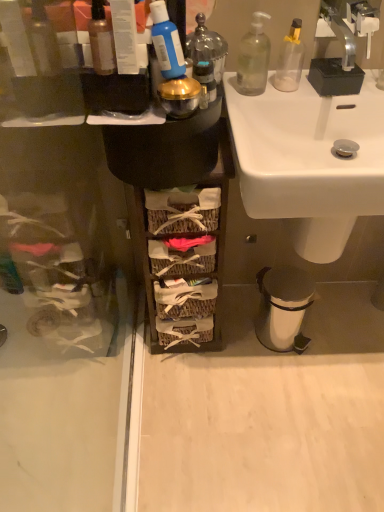
The image size is (384, 512). Find the location of `free point below transparent plastic screen door at left (from a real-world perspective)`. free point below transparent plastic screen door at left (from a real-world perspective) is located at coordinates (122, 425).